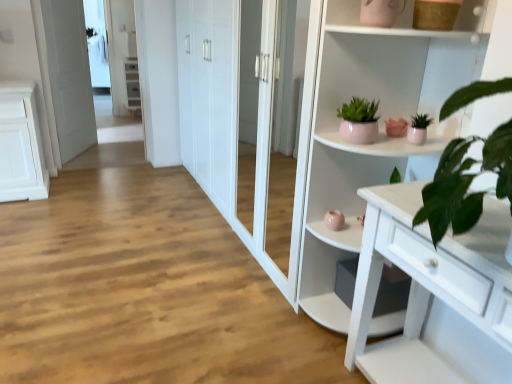
You are a GUI agent. You are given a task and a screenshot of the screen. Output one action in this format:
    pyautogui.click(x=<x>, y=<y>)
    Task: Click on the vacant space to the left of white glossy cupboard at upper right
    This screenshot has height=384, width=512.
    Given the screenshot: What is the action you would take?
    pyautogui.click(x=266, y=326)